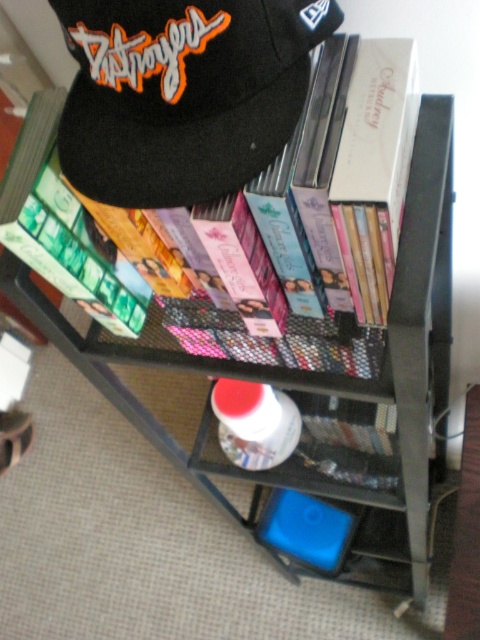
Question: Is black felt cap at upper left positioned at the back of white glossy bottle at center?

Choices:
 (A) no
 (B) yes

Answer: (A)

Question: From the image, what is the correct spatial relationship of black felt cap at upper left in relation to white glossy bottle at center?

Choices:
 (A) below
 (B) above

Answer: (B)

Question: Which object appears closest to the camera in this image?

Choices:
 (A) black felt cap at upper left
 (B) white glossy bottle at center

Answer: (A)

Question: Does black felt cap at upper left have a smaller size compared to white glossy bottle at center?

Choices:
 (A) yes
 (B) no

Answer: (A)

Question: Which point is farther from the camera taking this photo?

Choices:
 (A) 235,124
 (B) 250,445

Answer: (B)